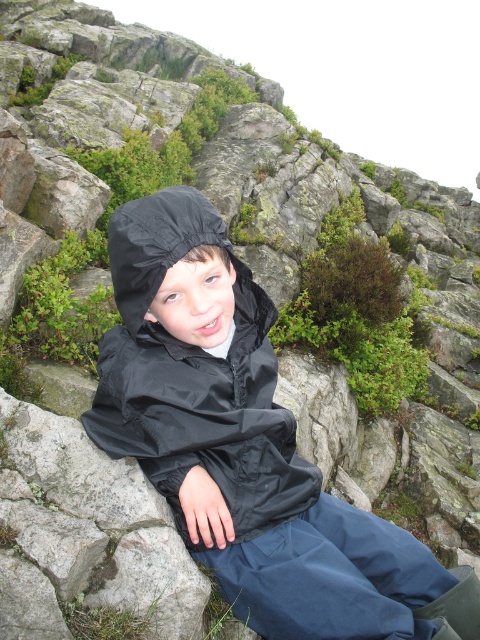
Question: Which object is closer to the camera taking this photo?

Choices:
 (A) black waterproof jacket at center
 (B) black nylon jacket at center

Answer: (B)

Question: Which object is closer to the camera taking this photo?

Choices:
 (A) black nylon jacket at center
 (B) black waterproof jacket at center

Answer: (A)

Question: Does black waterproof jacket at center lie in front of black nylon jacket at center?

Choices:
 (A) no
 (B) yes

Answer: (A)

Question: Is black waterproof jacket at center to the right of black nylon jacket at center from the viewer's perspective?

Choices:
 (A) yes
 (B) no

Answer: (A)

Question: Can you confirm if black waterproof jacket at center is wider than black nylon jacket at center?

Choices:
 (A) no
 (B) yes

Answer: (B)